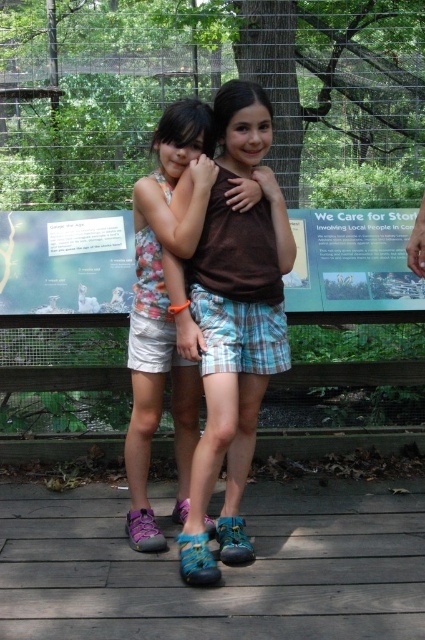
You are a photographer trying to capture the two girls in the scene. The girl with the brown cotton shirt at center is standing at point (x=232, y=323). If you want to frame both girls within your camera viewfinder, which direction should you move the camera to include the other girl?

The brown cotton shirt at center is located at point (x=232, y=323). To include the other girl, you should move the camera to the left since the other girl is positioned to the left of the brown cotton shirt at center.

From the picture: You are a photographer trying to capture a clear shot of both the brown cotton shirt at center and the floral fabric dress at center. Since the camera can only focus on one object at a time, which one should you focus on first to ensure the other is still somewhat in focus?

The brown cotton shirt at center is located below the floral fabric dress at center. Since they are positioned vertically, focusing on the floral fabric dress at center first would keep the brown cotton shirt at center in the background, still somewhat in focus.

You are a photographer standing at the camera position. You want to place a small decoration at point (x=266, y=305) in the scene. If your decoration is 1.5 meters tall, will it be visible above the two girls when viewed from the camera?

The point (x=266, y=305) is 2.62 meters away from the camera. Since the decoration is 1.5 meters tall, it will be visible above the girls if placed there, as the distance does not affect the height visibility. However, without knowing the girls height, it is impossible to determine if the decoration will be taller than them.